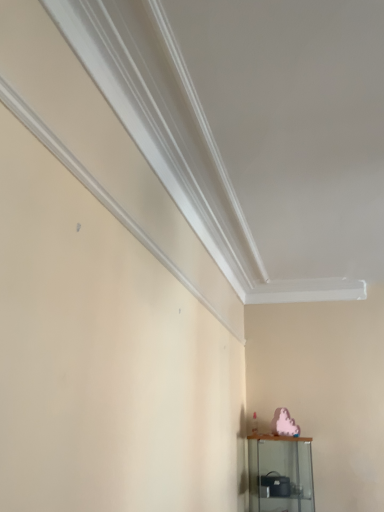
This screenshot has height=512, width=384. What do you see at coordinates (284, 423) in the screenshot?
I see `pink matte ghost at lower right` at bounding box center [284, 423].

In order to face pink matte ghost at lower right, should I rotate leftwards or rightwards?

A 12.468 degree turn to the right will do.

In order to click on pink matte ghost at lower right in this screenshot , I will do `click(284, 423)`.

Measure the distance between pink matte ghost at lower right and camera.

The depth of pink matte ghost at lower right is 3.52 meters.

The width and height of the screenshot is (384, 512). Describe the element at coordinates (280, 473) in the screenshot. I see `clear glass shelf at lower right` at that location.

What are the coordinates of `clear glass shelf at lower right` in the screenshot? It's located at (280, 473).

At what (x,y) coordinates should I click in order to perform the action: click on pink matte ghost at lower right. Please return your answer as a coordinate pair (x, y). Image resolution: width=384 pixels, height=512 pixels. Looking at the image, I should click on (284, 423).

Which object is positioned more to the left, clear glass shelf at lower right or pink matte ghost at lower right?

From the viewer's perspective, clear glass shelf at lower right appears more on the left side.

Is clear glass shelf at lower right behind pink matte ghost at lower right?

No, the depth of clear glass shelf at lower right is less than that of pink matte ghost at lower right.

Between point (311, 464) and point (285, 420), which one is positioned in front?

Positioned in front is point (311, 464).

From the image's perspective, would you say clear glass shelf at lower right is shown under pink matte ghost at lower right?

Correct, clear glass shelf at lower right appears lower than pink matte ghost at lower right in the image.

From a real-world perspective, does clear glass shelf at lower right sit lower than pink matte ghost at lower right?

Correct, in the physical world, clear glass shelf at lower right is lower than pink matte ghost at lower right.

Which object is thinner, clear glass shelf at lower right or pink matte ghost at lower right?

Thinner between the two is pink matte ghost at lower right.

Considering the sizes of objects clear glass shelf at lower right and pink matte ghost at lower right in the image provided, who is taller, clear glass shelf at lower right or pink matte ghost at lower right?

With more height is clear glass shelf at lower right.

Considering the sizes of objects clear glass shelf at lower right and pink matte ghost at lower right in the image provided, who is smaller, clear glass shelf at lower right or pink matte ghost at lower right?

Smaller between the two is pink matte ghost at lower right.

Would you say clear glass shelf at lower right is outside pink matte ghost at lower right?

clear glass shelf at lower right is positioned outside pink matte ghost at lower right.

Is clear glass shelf at lower right with pink matte ghost at lower right?

No, clear glass shelf at lower right is not making contact with pink matte ghost at lower right.

Is clear glass shelf at lower right facing towards pink matte ghost at lower right?

No, clear glass shelf at lower right does not turn towards pink matte ghost at lower right.

What's the angular difference between clear glass shelf at lower right and pink matte ghost at lower right's facing directions?

There is a 44.3-degree angle between the facing directions of clear glass shelf at lower right and pink matte ghost at lower right.

Image resolution: width=384 pixels, height=512 pixels. What are the coordinates of `shelf below the pink matte ghost at lower right (from a real-world perspective)` in the screenshot? It's located at (280, 473).

Which object is positioned more to the right, pink matte ghost at lower right or clear glass shelf at lower right?

pink matte ghost at lower right.

Which is behind, pink matte ghost at lower right or clear glass shelf at lower right?

pink matte ghost at lower right is further from the camera.

Which point is more distant from viewer, (295, 423) or (262, 490)?

Positioned behind is point (295, 423).

From the image's perspective, which object appears higher, pink matte ghost at lower right or clear glass shelf at lower right?

pink matte ghost at lower right appears higher in the image.

From a real-world perspective, is pink matte ghost at lower right physically below clear glass shelf at lower right?

No, from a real-world perspective, pink matte ghost at lower right is not below clear glass shelf at lower right.

In the scene shown: Which object is wider, pink matte ghost at lower right or clear glass shelf at lower right?

clear glass shelf at lower right is wider.

Considering the relative sizes of pink matte ghost at lower right and clear glass shelf at lower right in the image provided, is pink matte ghost at lower right shorter than clear glass shelf at lower right?

Correct, pink matte ghost at lower right is not as tall as clear glass shelf at lower right.

Considering the relative sizes of pink matte ghost at lower right and clear glass shelf at lower right in the image provided, is pink matte ghost at lower right bigger than clear glass shelf at lower right?

No.

Do you think pink matte ghost at lower right is within clear glass shelf at lower right, or outside of it?

pink matte ghost at lower right is spatially situated outside clear glass shelf at lower right.

Is pink matte ghost at lower right far away from clear glass shelf at lower right?

No, there isn't a large distance between pink matte ghost at lower right and clear glass shelf at lower right.

Consider the image. Could you tell me if pink matte ghost at lower right is turned towards clear glass shelf at lower right?

No.

How many degrees apart are the facing directions of pink matte ghost at lower right and clear glass shelf at lower right?

44.3 degrees separate the facing orientations of pink matte ghost at lower right and clear glass shelf at lower right.

Measure the distance between pink matte ghost at lower right and clear glass shelf at lower right.

11.31 inches.

Image resolution: width=384 pixels, height=512 pixels. In order to click on animal above the clear glass shelf at lower right (from the image's perspective) in this screenshot , I will do `click(284, 423)`.

In order to click on shelf that is in front of the pink matte ghost at lower right in this screenshot , I will do (x=280, y=473).

The image size is (384, 512). I want to click on shelf that is under the pink matte ghost at lower right (from a real-world perspective), so click(280, 473).